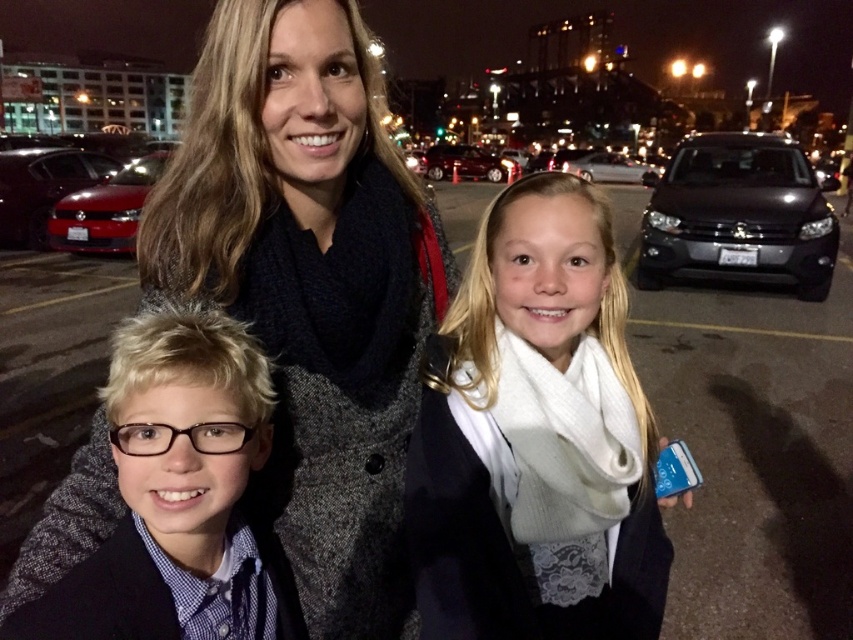
You are a photographer trying to capture the three people in the scene. Since the white knit scarf at center and the shiny red car at left are both in the frame, can you determine which one is narrower?

The white knit scarf at center is narrower than the shiny red car at left because its width is less than the car.

You are a photographer taking a picture of the matte black glasses at lower left and the white glossy sedan at center. Which object is closer to the camera?

The matte black glasses at lower left is positioned under the white glossy sedan at center, so the glasses are closer to the camera than the sedan.